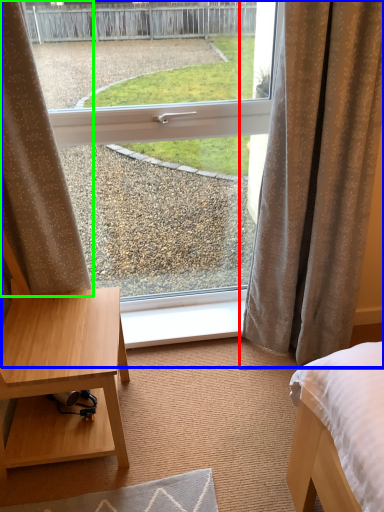
Question: Which object is the closest to the curtain (highlighted by a red box)? Choose among these: window (highlighted by a blue box) or curtain (highlighted by a green box).

Choices:
 (A) window
 (B) curtain

Answer: (A)